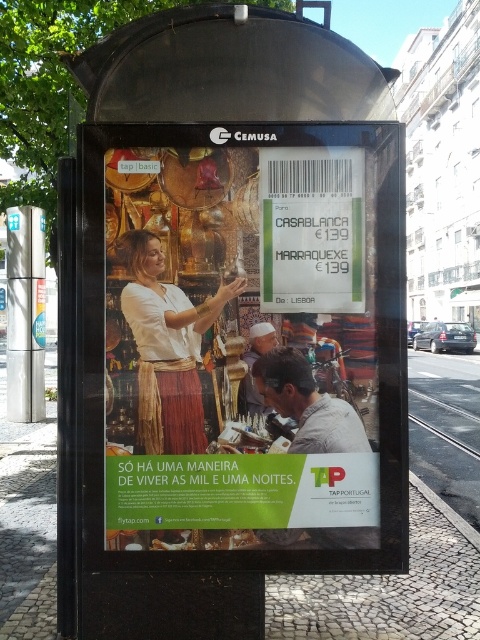
You are standing at the bus stop and want to place a small potted plant exactly at the location marked by the cobblestone pavement at lower center. What are the coordinates where you should place the plant?

The coordinates for the cobblestone pavement at lower center are at point (388,589), so you should place the plant there.

You are a pedestrian approaching the bus stop and want to read both the matte gold poster at center and the green matte sign at center. Which one should you look at first if you want to read them in the order they are displayed from top to bottom?

The matte gold poster at center is below the green matte sign at center, so you should look at the green matte sign at center first as it is positioned above.